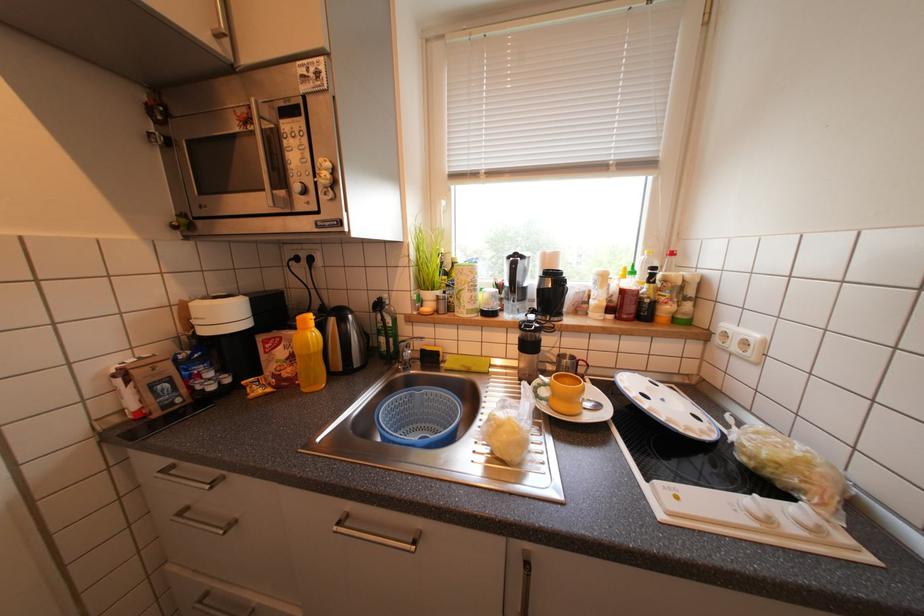
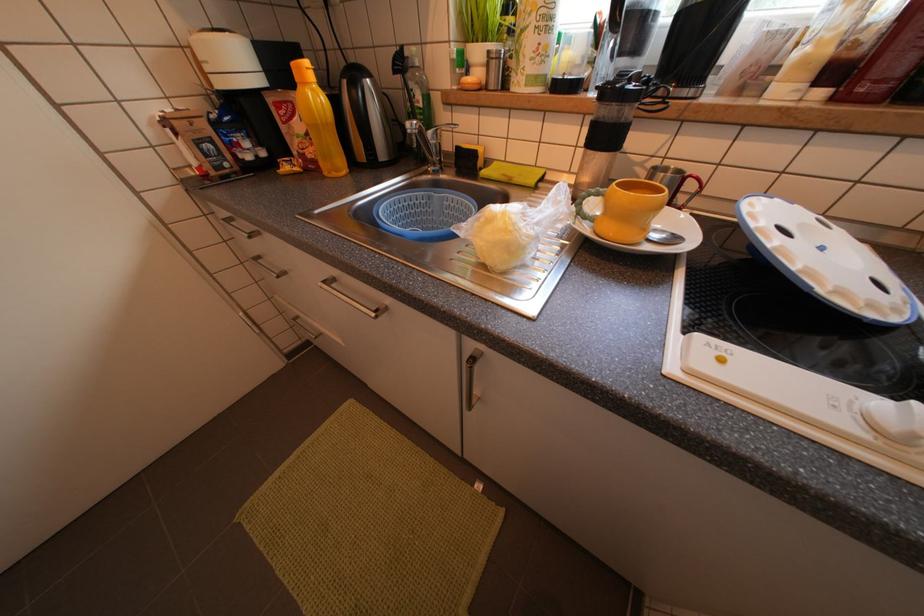
How did the camera likely rotate?

The rotation direction of the camera is left-down.